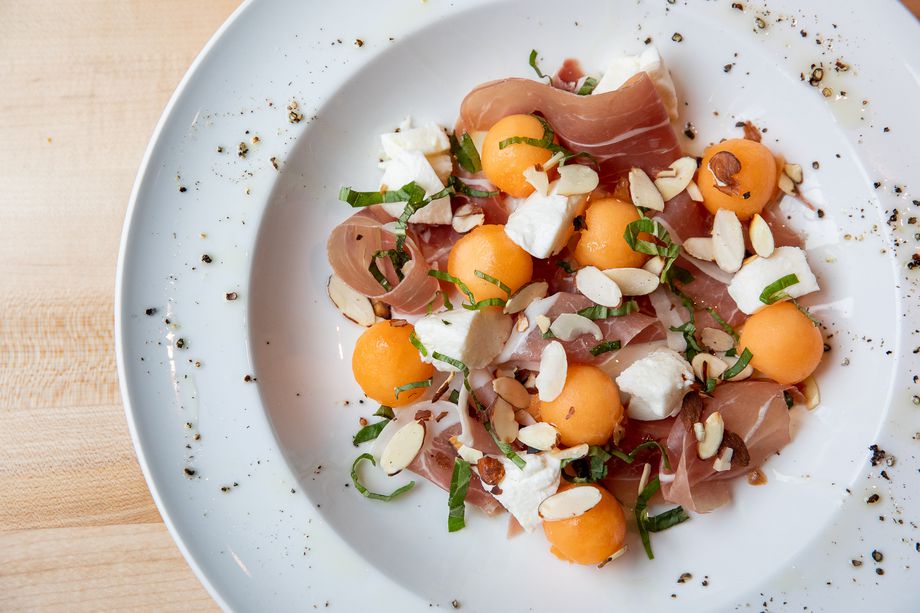
Locate an element on the screen. The image size is (920, 613). surface is located at coordinates (87, 177).